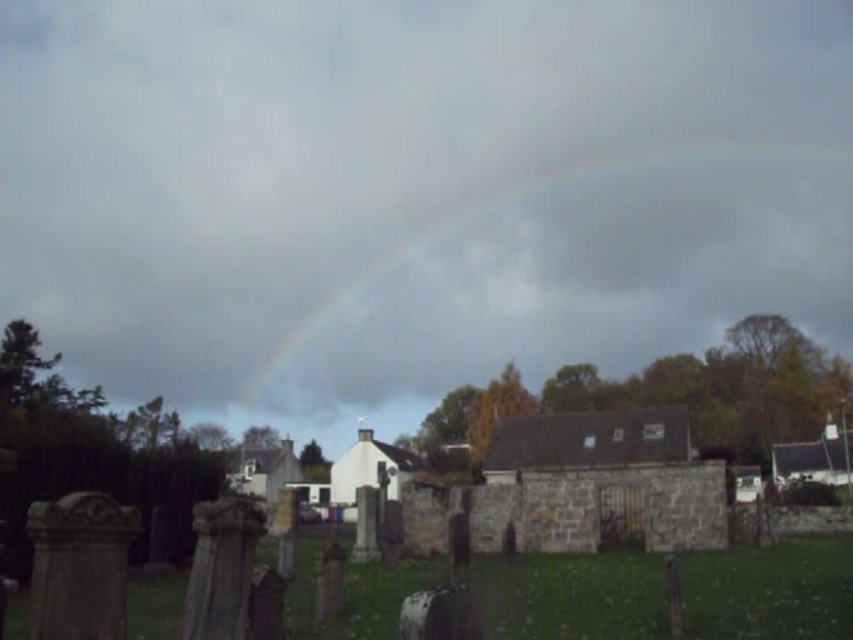
You are standing in a cemetery looking at the rainbow. You notice two points in the image, one at coordinates point (x=752, y=257) and another at point (x=99, y=531). Which point is closer to your eyes?

Point (x=752, y=257) is further to the viewer than point (x=99, y=531), so the point closer to your eyes is point (x=99, y=531).

You are standing in the cemetery looking up at the rainbow at upper center. Can you see the smooth stone gravestone at lower left behind the rainbow?

Yes, the smooth stone gravestone at lower left is behind the rainbow at upper center, so it is visible behind it.